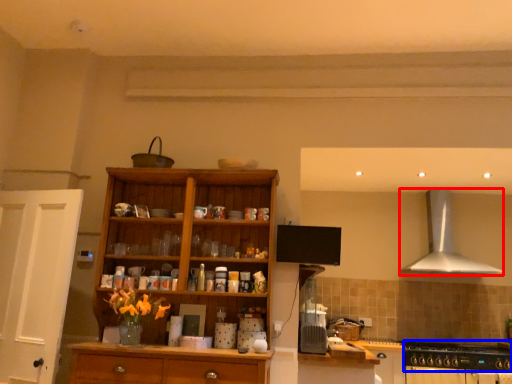
Question: Which object appears closest to the camera in this image, kitchen appliance (highlighted by a red box) or gas stove (highlighted by a blue box)?

Choices:
 (A) kitchen appliance
 (B) gas stove

Answer: (B)